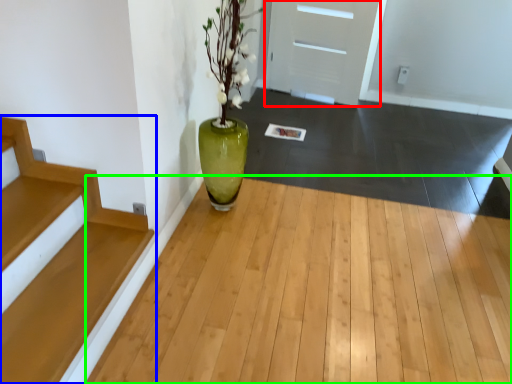
Question: Considering the real-world distances, which object is closest to door (highlighted by a red box)? stairs (highlighted by a blue box) or corridor (highlighted by a green box).

Choices:
 (A) stairs
 (B) corridor

Answer: (B)